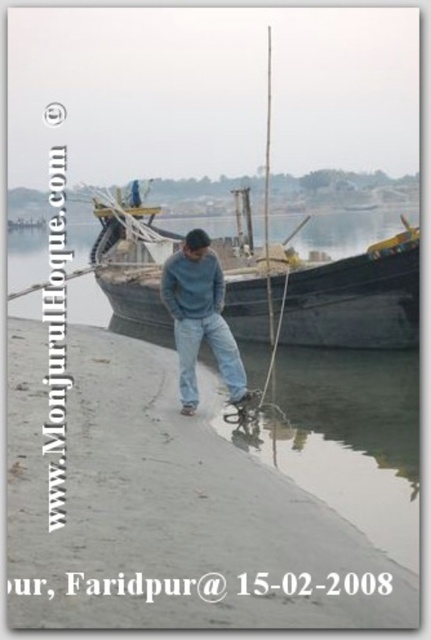
You are a photographer planning to take a wide shot of the wooden boat at center and denim jeans at center. Given that your camera has a maximum width capacity of 2 meters, will both objects fit in the frame without cropping?

The wooden boat at center is wider than the denim jeans at center. Since the boat is wider and the camera can capture up to 2 meters, we need to know the exact width of the boat to determine if it fits. However, the description only states that the boat is wider than the jeans, not the specific measurement. Therefore, it is uncertain if both will fit without more information.

You are standing on the smooth concrete shore at center and want to move to the matte blue jeans at center. In which direction should you walk?

The smooth concrete shore at center is positioned on the left side of matte blue jeans at center, so you should walk to the right to reach the matte blue jeans at center.